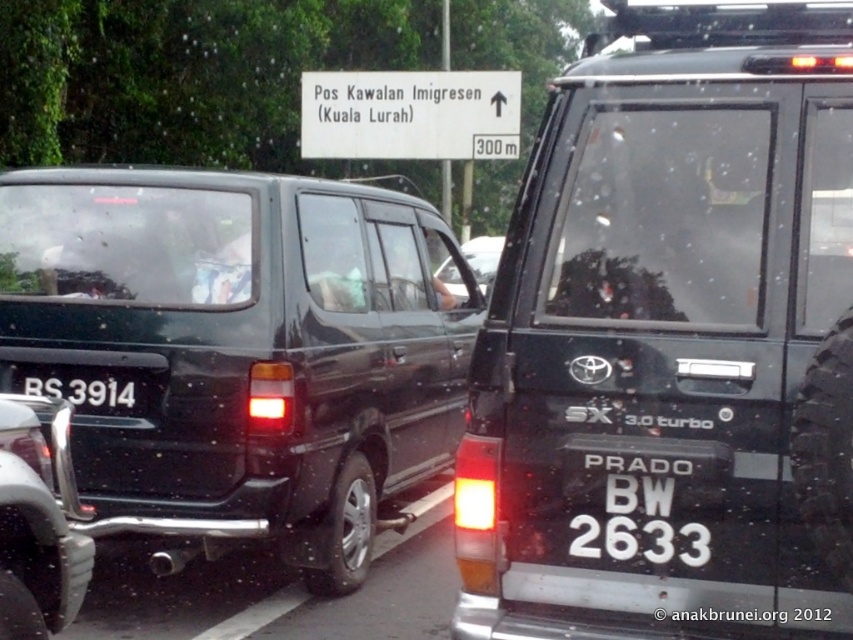
The image size is (853, 640). Find the location of `brushed metal bumper at rear`. brushed metal bumper at rear is located at coordinates 38,524.

Does brushed metal bumper at rear have a lesser width compared to black plastic license plate at rear?

Yes.

Is point (3, 596) less distant than point (108, 390)?

Yes, point (3, 596) is closer to viewer.

This screenshot has width=853, height=640. Identify the location of brushed metal bumper at rear. (38, 524).

From the picture: Can you confirm if black matte van at center is wider than white plastic sign at upper center?

No.

Is black matte van at center positioned before white plastic sign at upper center?

Yes, it is in front of white plastic sign at upper center.

Does point (3, 368) come closer to viewer compared to point (498, 84)?

Yes, it is.

Where is `black matte van at center`? The width and height of the screenshot is (853, 640). black matte van at center is located at coordinates (242, 349).

Which is behind, point (178, 419) or point (78, 534)?

Point (178, 419)

The width and height of the screenshot is (853, 640). Find the location of `black matte van at center`. black matte van at center is located at coordinates (242, 349).

At what (x,y) coordinates should I click in order to perform the action: click on black matte van at center. Please return your answer as a coordinate pair (x, y). The height and width of the screenshot is (640, 853). Looking at the image, I should click on (242, 349).